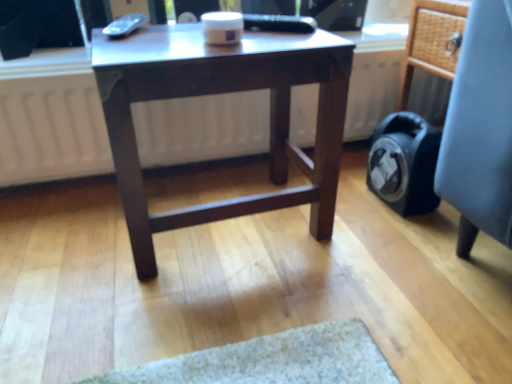
Question: Considering the relative positions of light blue fabric chair at right and dark brown wood table at center in the image provided, is light blue fabric chair at right behind dark brown wood table at center?

Choices:
 (A) no
 (B) yes

Answer: (B)

Question: Is light blue fabric chair at right smaller than dark brown wood table at center?

Choices:
 (A) yes
 (B) no

Answer: (A)

Question: Would you consider light blue fabric chair at right to be distant from dark brown wood table at center?

Choices:
 (A) yes
 (B) no

Answer: (B)

Question: Considering the relative positions of light blue fabric chair at right and dark brown wood table at center in the image provided, is light blue fabric chair at right to the right of dark brown wood table at center from the viewer's perspective?

Choices:
 (A) yes
 (B) no

Answer: (A)

Question: From the image's perspective, is light blue fabric chair at right above dark brown wood table at center?

Choices:
 (A) yes
 (B) no

Answer: (A)

Question: From a real-world perspective, is light blue fabric chair at right located higher than dark brown wood table at center?

Choices:
 (A) yes
 (B) no

Answer: (B)

Question: Is dark brown wood table at center oriented away from light blue fabric chair at right?

Choices:
 (A) yes
 (B) no

Answer: (B)

Question: Is the position of dark brown wood table at center less distant than that of light blue fabric chair at right?

Choices:
 (A) yes
 (B) no

Answer: (A)

Question: Can you confirm if dark brown wood table at center is wider than light blue fabric chair at right?

Choices:
 (A) no
 (B) yes

Answer: (A)

Question: Is dark brown wood table at center not close to light blue fabric chair at right?

Choices:
 (A) no
 (B) yes

Answer: (A)

Question: Considering the relative sizes of dark brown wood table at center and light blue fabric chair at right in the image provided, is dark brown wood table at center bigger than light blue fabric chair at right?

Choices:
 (A) no
 (B) yes

Answer: (B)

Question: Could light blue fabric chair at right be considered to be inside dark brown wood table at center?

Choices:
 (A) no
 (B) yes

Answer: (A)

Question: From their relative heights in the image, would you say light blue fabric chair at right is taller or shorter than dark brown wood table at center?

Choices:
 (A) tall
 (B) short

Answer: (A)